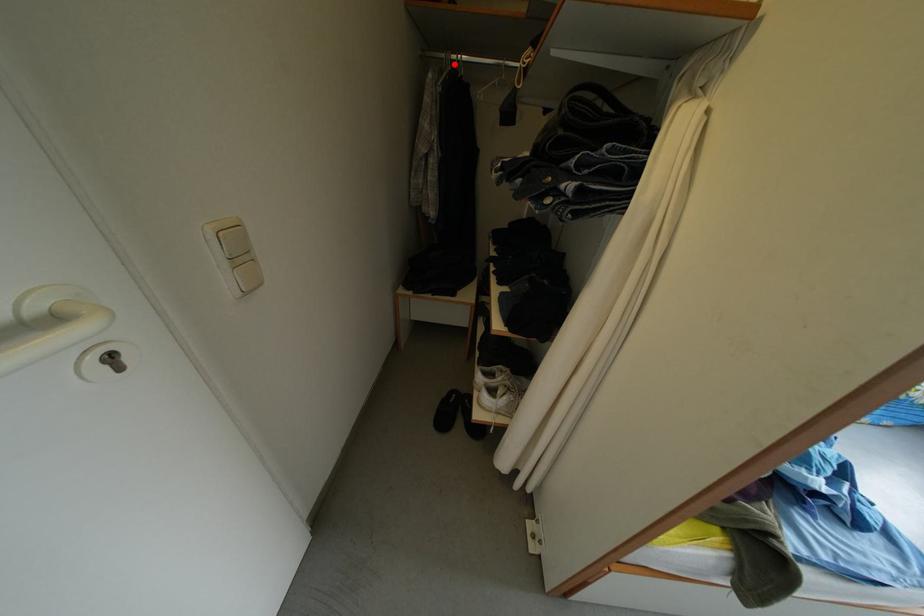
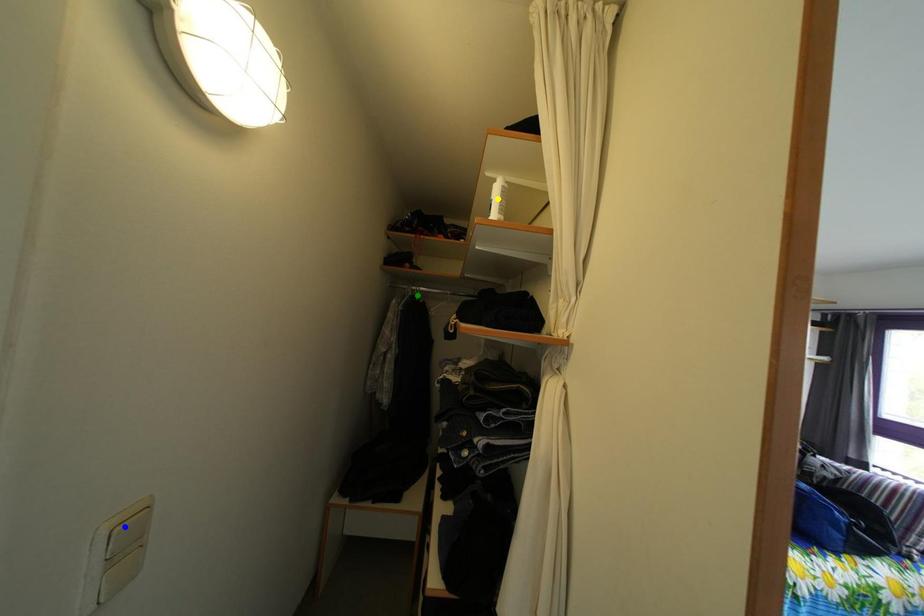
Question: I am providing you with two images of the same scene from different viewpoints. A red point is marked on the first image. You are given multiple points on the second image. Which spot in image 2 lines up with the point in image 1?

Choices:
 (A) green point
 (B) blue point
 (C) yellow point

Answer: (A)